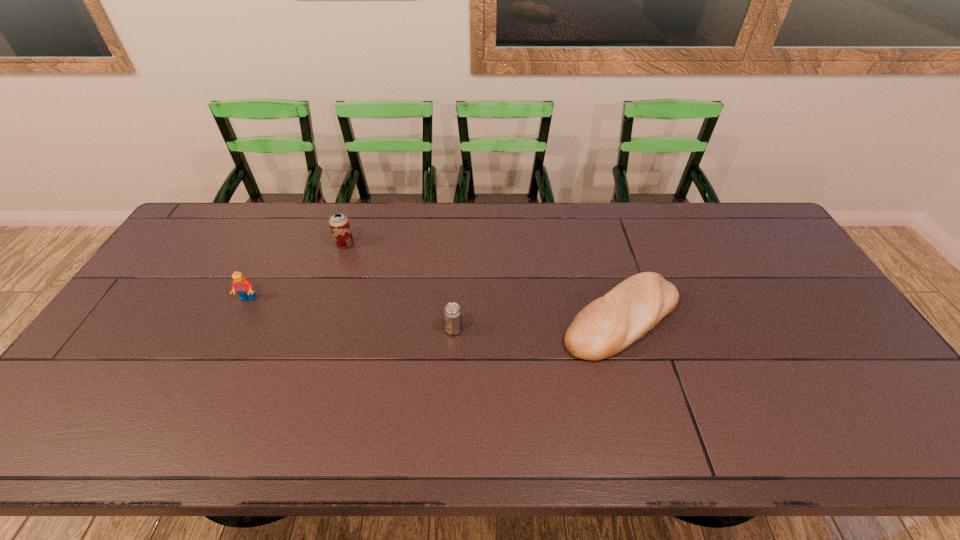
Where is `empty location between the left beer can and the second object from right to left`? empty location between the left beer can and the second object from right to left is located at coordinates (399, 287).

Where is `blank region between the Lego and the second object from left to right`? Image resolution: width=960 pixels, height=540 pixels. blank region between the Lego and the second object from left to right is located at coordinates [297, 272].

Find the location of `vacant space in between the bread and the second object from right to left`. vacant space in between the bread and the second object from right to left is located at coordinates (538, 324).

Where is `vacant area that lies between the farther beer can and the third object from left to right`? The width and height of the screenshot is (960, 540). vacant area that lies between the farther beer can and the third object from left to right is located at coordinates (399, 287).

Select which object is the closest to the bread. Please provide its 2D coordinates. Your answer should be formatted as a tuple, i.e. [(x, y)], where the tuple contains the x and y coordinates of a point satisfying the conditions above.

[(452, 313)]

Point out which object is positioned as the third nearest to the second object from left to right. Please provide its 2D coordinates. Your answer should be formatted as a tuple, i.e. [(x, y)], where the tuple contains the x and y coordinates of a point satisfying the conditions above.

[(609, 324)]

You are a GUI agent. You are given a task and a screenshot of the screen. Output one action in this format:
    pyautogui.click(x=<x>, y=<y>)
    Task: Click on the vacant area that satisfies the following two spatial constraints: 1. on the back side of the nearer beer can; 2. on the left side of the rightmost object
    
    Given the screenshot: What is the action you would take?
    pyautogui.click(x=454, y=319)

The width and height of the screenshot is (960, 540). Identify the location of blank space that satisfies the following two spatial constraints: 1. on the face of the Lego; 2. on the right side of the nearer beer can. (233, 329).